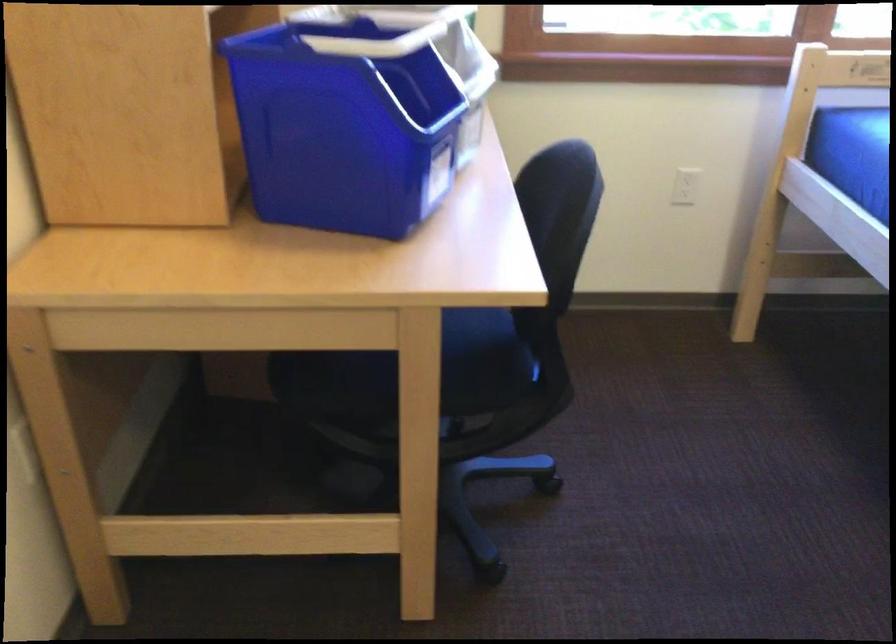
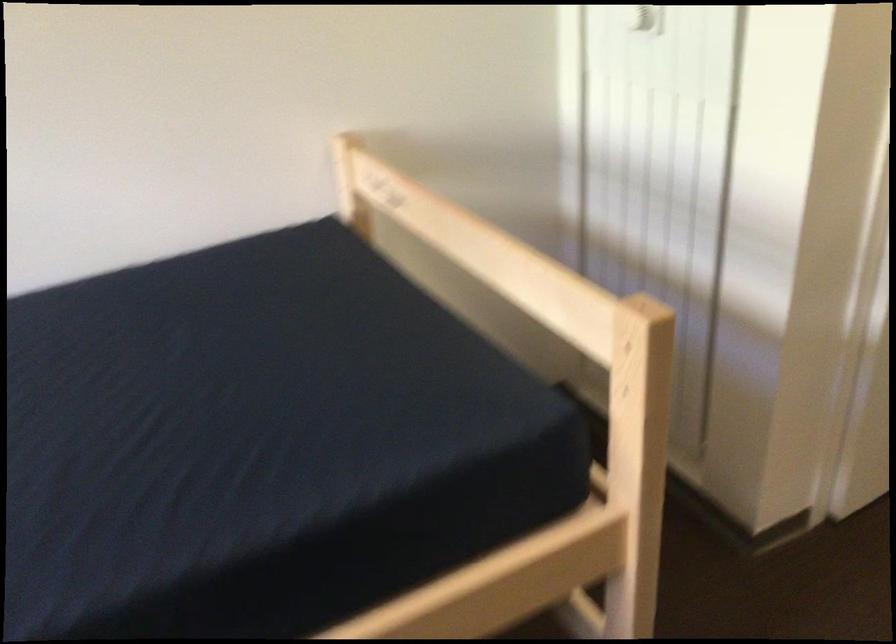
Based on the continuous images, in which direction is the camera rotating?

The camera's rotation is toward right-down.